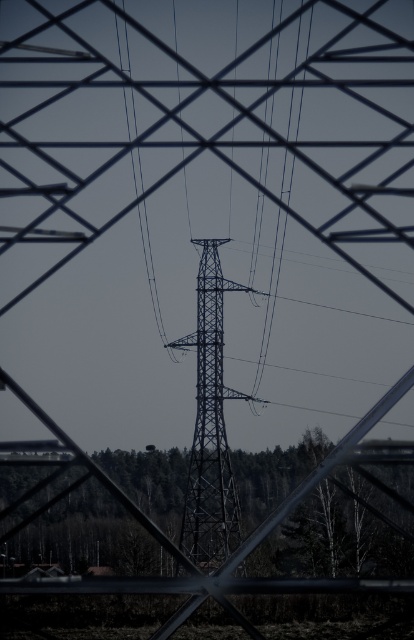
Between point (206, 305) and point (308, 42), which one is positioned behind?

The point (206, 305) is more distant.

Is the position of metallic structure at center less distant than that of blue wire at center?

No, it is behind blue wire at center.

Locate an element on the screen. Image resolution: width=414 pixels, height=640 pixels. metallic structure at center is located at coordinates (209, 426).

The image size is (414, 640). Find the location of `metallic structure at center`. metallic structure at center is located at coordinates (209, 426).

Describe the element at coordinates (271, 292) in the screenshot. I see `blue wire at center` at that location.

Which of these two, blue wire at center or black wire at center, stands taller?

blue wire at center

Find the location of a particular element. The height and width of the screenshot is (640, 414). blue wire at center is located at coordinates (271, 292).

Can you confirm if metallic structure at center is positioned to the right of black wire at center?

Yes, metallic structure at center is to the right of black wire at center.

Is metallic structure at center shorter than black wire at center?

Yes.

At what (x,y) coordinates should I click in order to perform the action: click on metallic structure at center. Please return your answer as a coordinate pair (x, y). This screenshot has width=414, height=640. Looking at the image, I should click on (209, 426).